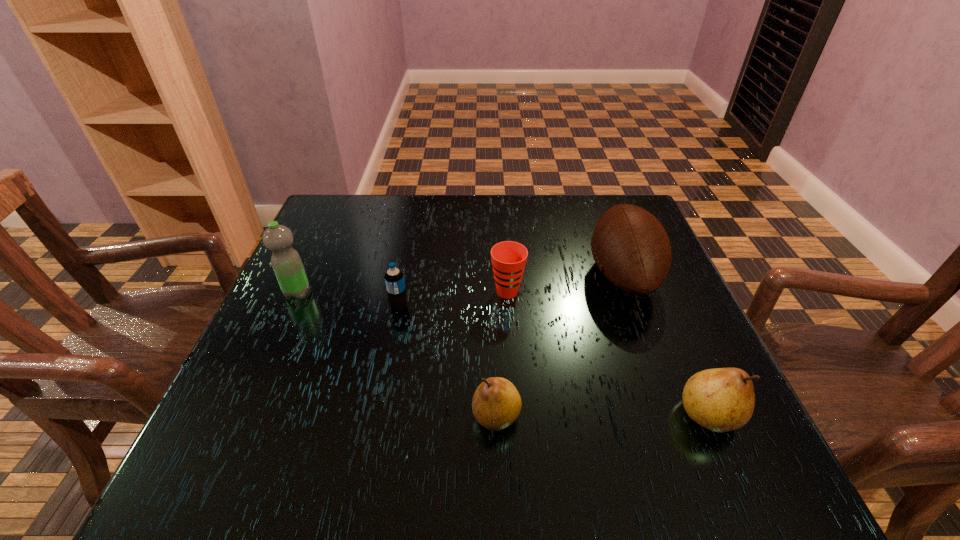
Locate an element on the screen. Image resolution: width=960 pixels, height=540 pixels. the left pear is located at coordinates pos(496,404).

Locate an element on the screen. The height and width of the screenshot is (540, 960). the taller pear is located at coordinates (722, 399).

Find the location of `soda bottle`. soda bottle is located at coordinates (394, 279).

Locate an element on the screen. water bottle is located at coordinates (286, 262).

Locate an element on the screen. The width and height of the screenshot is (960, 540). football is located at coordinates (631, 248).

Where is `cup`? The image size is (960, 540). cup is located at coordinates (508, 258).

Identify the location of free region located on the left of the shorter pear. The height and width of the screenshot is (540, 960). (278, 416).

What are the coordinates of `vacant space located on the left of the taller pear` in the screenshot? It's located at click(x=579, y=415).

At what (x,y) coordinates should I click in order to perform the action: click on free region located on the back of the second object from left to right. Please return your answer as a coordinate pair (x, y). The height and width of the screenshot is (540, 960). Looking at the image, I should click on (408, 261).

Find the location of a particular element. The image size is (960, 540). vacant area situated 0.160m on the right of the water bottle is located at coordinates (382, 293).